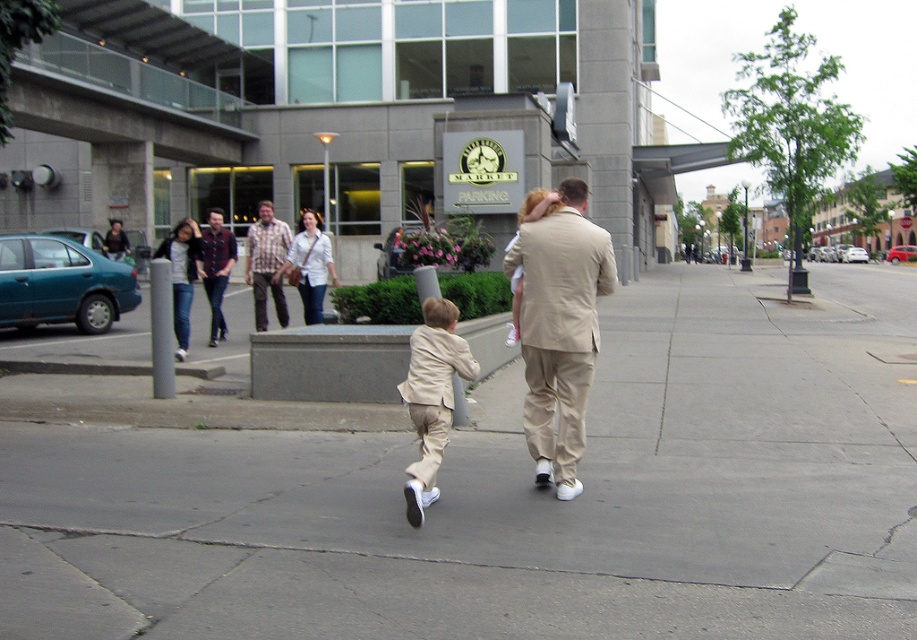
Question: Can you confirm if matte khaki suit at center is wider than light beige suit at center?

Choices:
 (A) yes
 (B) no

Answer: (A)

Question: Which of these objects is positioned farthest from the light beige suit at center?

Choices:
 (A) maroon plaid shirt at center
 (B) beige cotton suit at center
 (C) concrete sidewalk at center
 (D) plaid shirt at center

Answer: (A)

Question: Estimate the real-world distances between objects in this image. Which object is farther from the matte khaki suit at center?

Choices:
 (A) maroon plaid shirt at center
 (B) concrete sidewalk at center
 (C) plaid shirt at center

Answer: (A)

Question: Does concrete sidewalk at center have a greater width compared to maroon plaid shirt at center?

Choices:
 (A) yes
 (B) no

Answer: (A)

Question: Does beige cotton suit at center appear on the right side of light beige suit at center?

Choices:
 (A) yes
 (B) no

Answer: (B)

Question: Which of the following is the closest to the observer?

Choices:
 (A) (286, 314)
 (B) (425, 477)
 (C) (529, 192)
 (D) (206, 250)

Answer: (B)